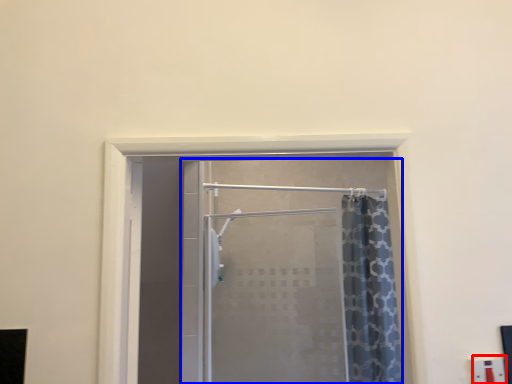
Question: Which of the following is the closest to the observer, electric outlet (highlighted by a red box) or door (highlighted by a blue box)?

Choices:
 (A) electric outlet
 (B) door

Answer: (A)